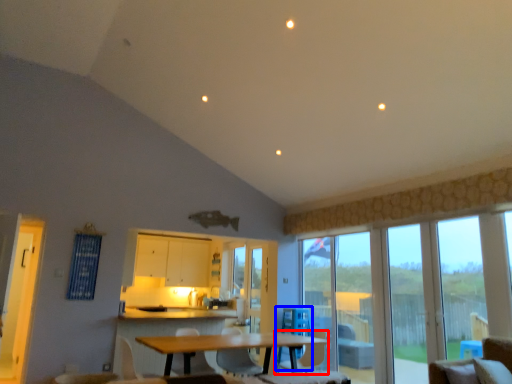
Question: Which object is further to the camera taking this photo, chair (highlighted by a red box) or swivel chair (highlighted by a blue box)?

Choices:
 (A) chair
 (B) swivel chair

Answer: (B)